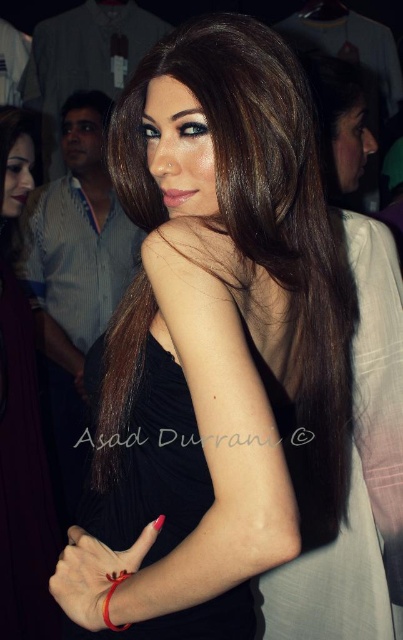
Question: Does black matte dress at center have a lesser width compared to red matte bracelet at lower left?

Choices:
 (A) yes
 (B) no

Answer: (B)

Question: Can you confirm if black matte dress at center is wider than gold metallic bracelet at center?

Choices:
 (A) no
 (B) yes

Answer: (B)

Question: Which of the following is the closest to the observer?

Choices:
 (A) (139, 547)
 (B) (197, 621)

Answer: (A)

Question: Among these points, which one is farthest from the camera?

Choices:
 (A) (6, 424)
 (B) (124, 577)
 (C) (68, 611)
 (D) (99, 392)

Answer: (A)

Question: Can you confirm if black ribbed dress at center is smaller than black matte dress at center?

Choices:
 (A) yes
 (B) no

Answer: (A)

Question: Which point appears farthest from the camera in this image?

Choices:
 (A) [122, 628]
 (B) [188, 522]

Answer: (B)